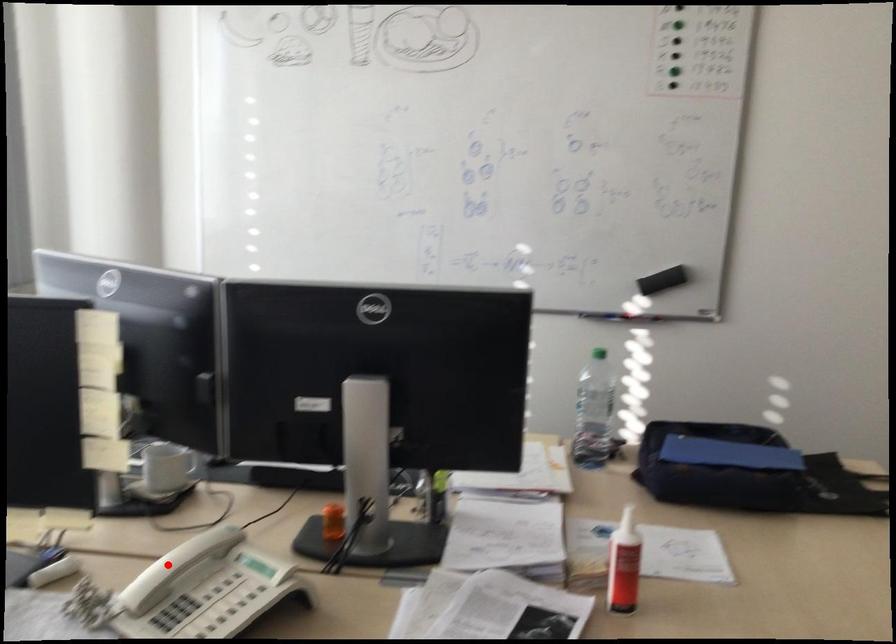
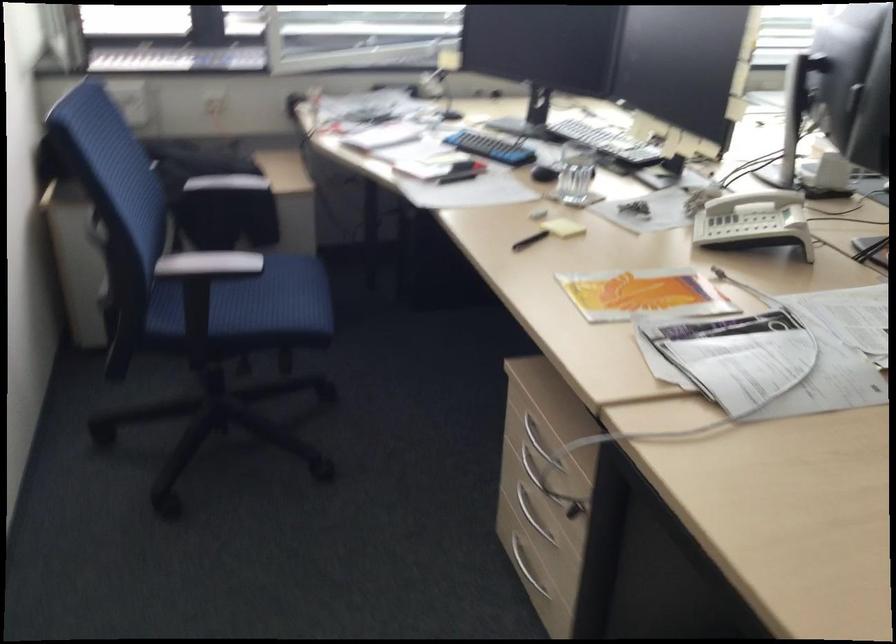
Find the pixel in the second image that matches the highlighted location in the first image.

(753, 200)